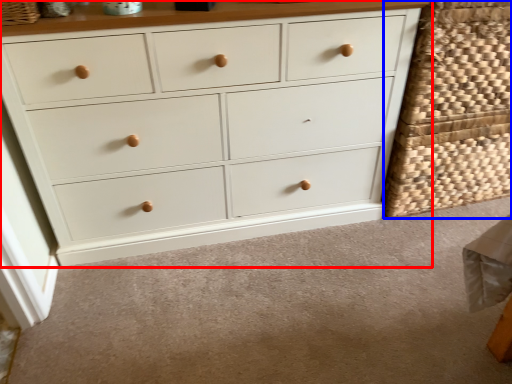
Question: Which point is further to the camera, chest of drawers (highlighted by a red box) or basket (highlighted by a blue box)?

Choices:
 (A) chest of drawers
 (B) basket

Answer: (B)